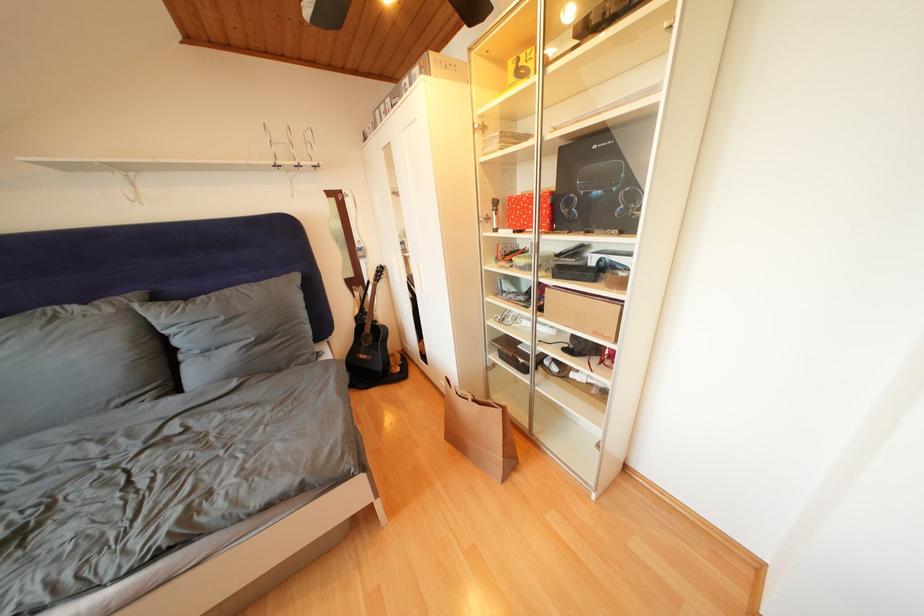
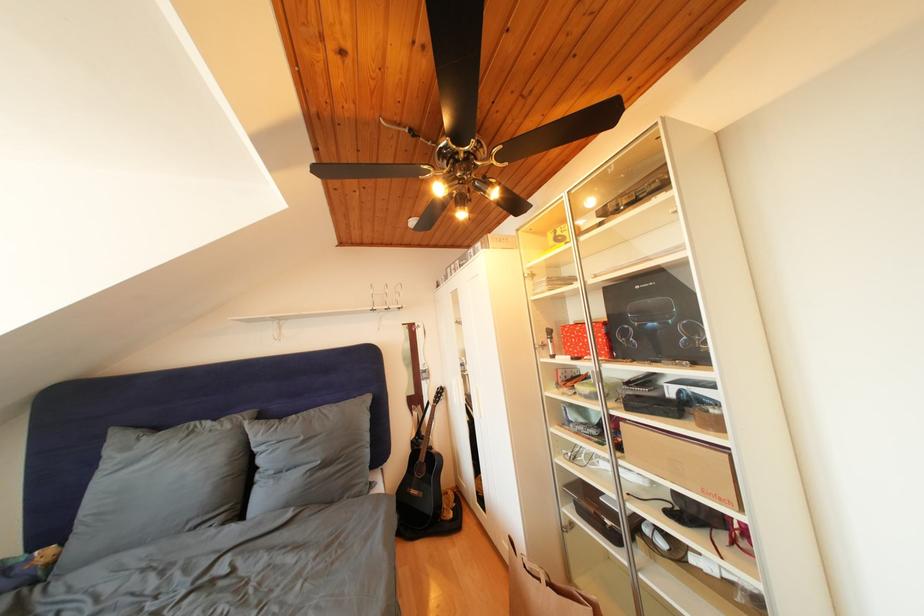
Locate, in the second image, the point that corresponds to (363,323) in the first image.

(420, 447)